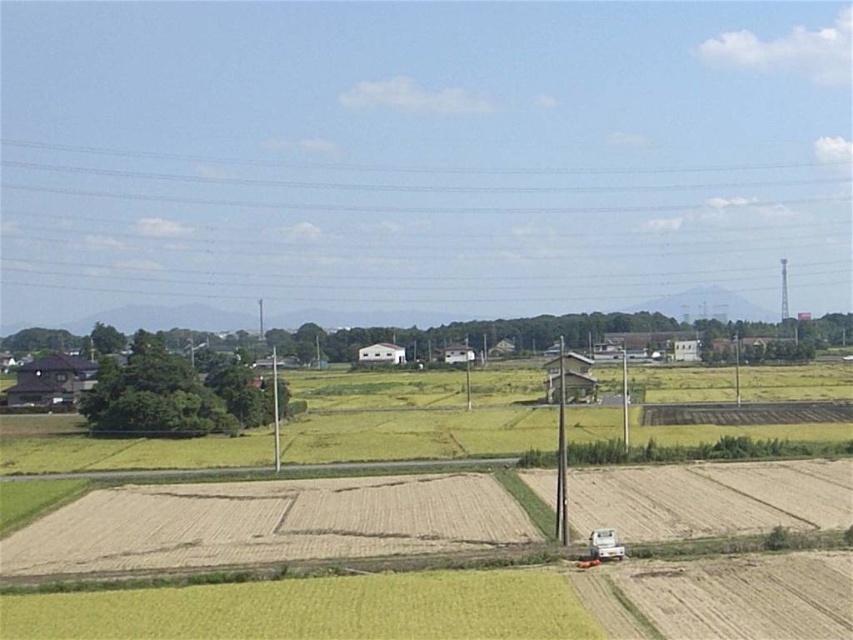
You are a farmer who wants to mow the fields. You have a lawnmower that can only cut grass up to 15 cm tall. Which field should you mow first, the green grass field at center or the green grassy field at lower center?

The green grassy field at lower center should be mowed first because the green grass field at center is much taller and may exceed the lawnmower height limit of 15 cm.